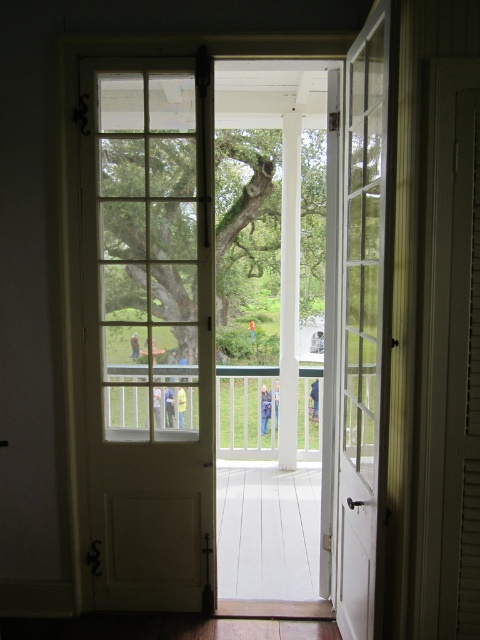
In the scene shown: Who is taller, white wood door at center or white glass door at center?

With more height is white wood door at center.

Where is `white wood door at center`? white wood door at center is located at coordinates (149, 332).

You are a GUI agent. You are given a task and a screenshot of the screen. Output one action in this format:
    pyautogui.click(x=<x>, y=<y>)
    Task: Click on the white wood door at center
    The height and width of the screenshot is (640, 480).
    Given the screenshot: What is the action you would take?
    pyautogui.click(x=149, y=332)